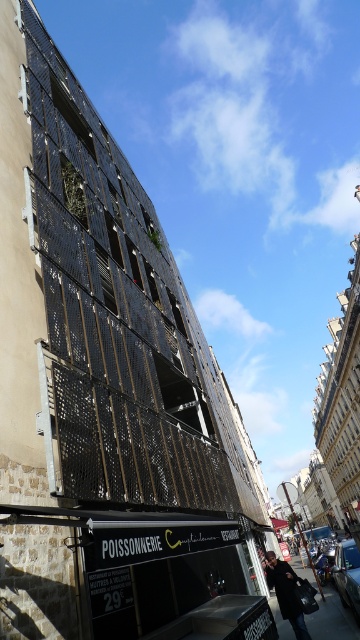
Is black perforated metal scaffolding at left to the right of metallic mesh construction at lower right from the viewer's perspective?

No, black perforated metal scaffolding at left is not to the right of metallic mesh construction at lower right.

Measure the distance between black perforated metal scaffolding at left and camera.

black perforated metal scaffolding at left is 5.65 meters from camera.

At what (x,y) coordinates should I click in order to perform the action: click on black perforated metal scaffolding at left. Please return your answer as a coordinate pair (x, y). The image size is (360, 640). Looking at the image, I should click on (119, 317).

Does point (322, 636) come behind point (303, 630)?

That is True.

Does metallic mesh construction at lower right appear on the right side of dark brown leather coat at lower right?

Correct, you'll find metallic mesh construction at lower right to the right of dark brown leather coat at lower right.

Locate an element on the screen. This screenshot has width=360, height=640. metallic mesh construction at lower right is located at coordinates tap(331, 618).

Who is lower down, black perforated metal scaffolding at left or dark brown leather coat at lower right?

dark brown leather coat at lower right is below.

Who is more forward, [236,486] or [272,576]?

Positioned in front is point [272,576].

Locate an element on the screen. This screenshot has height=640, width=360. black perforated metal scaffolding at left is located at coordinates (119, 317).